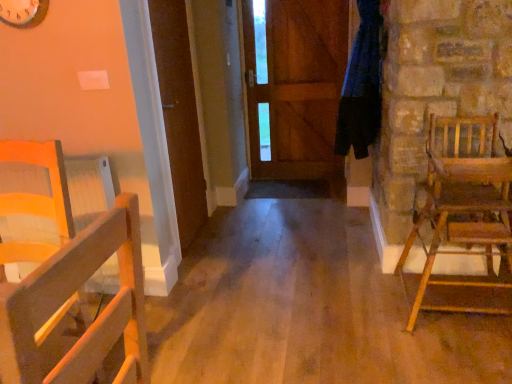
Question: From their relative heights in the image, would you say wooden clock at upper left is taller or shorter than wooden door at center, positioned as the 1th door in front-to-back order?

Choices:
 (A) short
 (B) tall

Answer: (A)

Question: Does point (29, 9) appear closer or farther from the camera than point (170, 82)?

Choices:
 (A) closer
 (B) farther

Answer: (A)

Question: Based on their relative distances, which object is nearer to the wooden door at center, marked as the 1th door in a back-to-front arrangement?

Choices:
 (A) wooden clock at upper left
 (B) wooden rocking chair at right, marked as the 1th chair in a right-to-left arrangement
 (C) wooden door at center, acting as the 2th door starting from the right
 (D) blue fabric at right
 (E) wooden chair at left, which is the second chair in right-to-left order

Answer: (D)

Question: Estimate the real-world distances between objects in this image. Which object is closer to the wooden door at center, which ranks as the second door in left-to-right order?

Choices:
 (A) wooden door at center, the first door in the left-to-right sequence
 (B) wooden chair at left, which is the second chair in right-to-left order
 (C) wooden rocking chair at right, marked as the 1th chair in a right-to-left arrangement
 (D) blue fabric at right
 (E) wooden clock at upper left

Answer: (D)